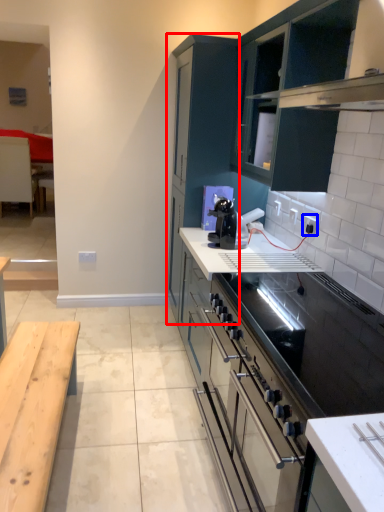
Question: Which object appears farthest to the camera in this image, cabinetry (highlighted by a red box) or electric outlet (highlighted by a blue box)?

Choices:
 (A) cabinetry
 (B) electric outlet

Answer: (A)